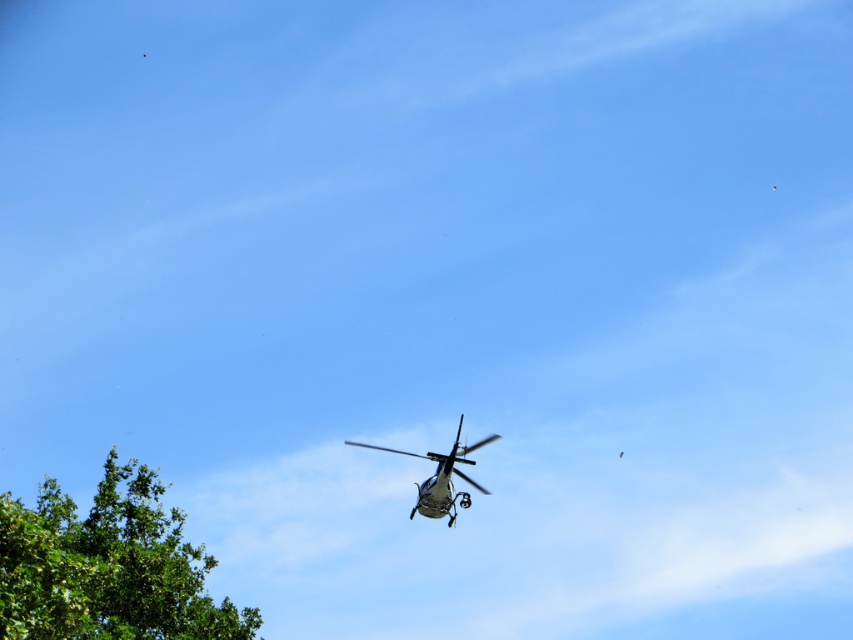
You are a drone pilot trying to navigate your drone through the area. You see a point marked at coordinates (x=107, y=566). What object does this point correspond to in the scene?

The point corresponds to the green leafy tree at lower left.

You are a pilot flying a metallic silver helicopter at center. You notice a green leafy tree at lower left in your flight path. Which object is taller? Please answer based on their actual heights in the scene.

The green leafy tree at lower left is taller than the metallic silver helicopter at center.